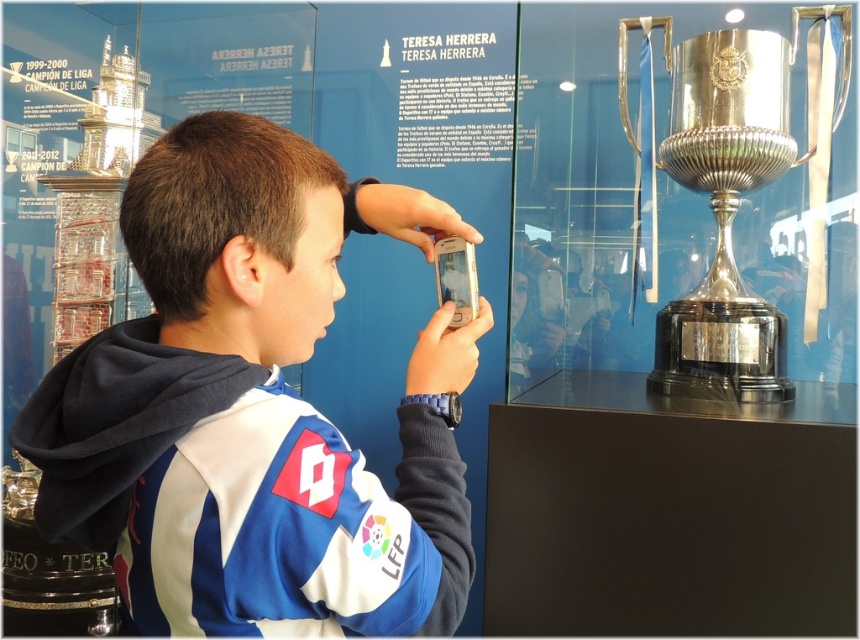
Question: Which of the following is the farthest from the observer?

Choices:
 (A) brown hair at upper center
 (B) polished silver trophy at right
 (C) blue fabric jacket at center

Answer: (B)

Question: Can you confirm if blue fabric jacket at center is positioned to the right of polished silver trophy at right?

Choices:
 (A) yes
 (B) no

Answer: (B)

Question: Can you confirm if blue fabric jacket at center is positioned above polished silver trophy at right?

Choices:
 (A) yes
 (B) no

Answer: (B)

Question: Among these points, which one is nearest to the camera?

Choices:
 (A) tap(106, 465)
 (B) tap(229, 236)
 (C) tap(691, 96)

Answer: (A)

Question: Which of the following is the closest to the observer?

Choices:
 (A) polished silver trophy at right
 (B) blue fabric jacket at center
 (C) brown hair at upper center

Answer: (B)

Question: Is brown hair at upper center to the left of polished silver trophy at right from the viewer's perspective?

Choices:
 (A) no
 (B) yes

Answer: (B)